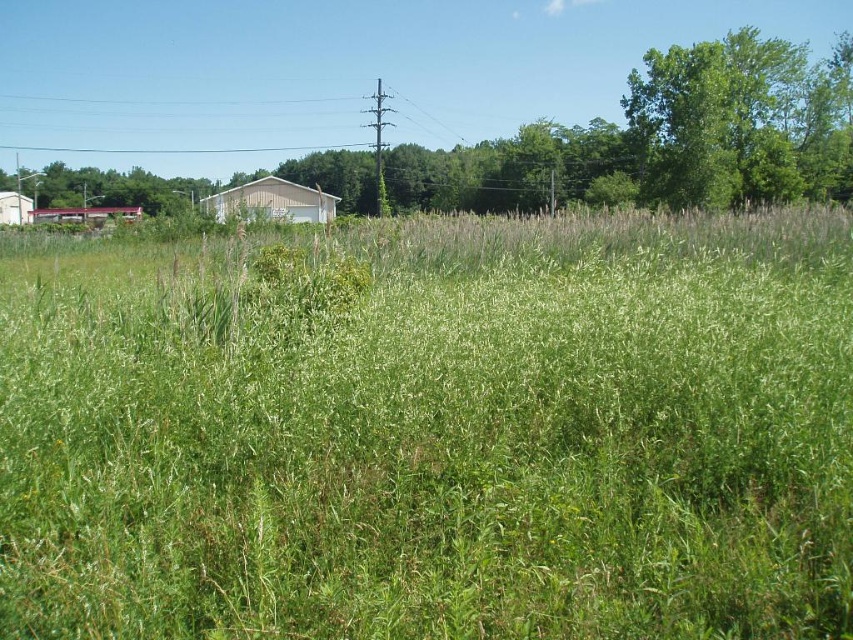
Question: Which point is closer to the camera?

Choices:
 (A) (248, 186)
 (B) (676, 205)

Answer: (B)

Question: Observing the image, what is the correct spatial positioning of green leafy tree at upper right in reference to white wood hut at left?

Choices:
 (A) right
 (B) left

Answer: (A)

Question: Among these points, which one is farthest from the camera?

Choices:
 (A) pyautogui.click(x=839, y=154)
 (B) pyautogui.click(x=132, y=192)
 (C) pyautogui.click(x=6, y=204)

Answer: (B)

Question: Is white matte barn at center thinner than metallic red hut at left?

Choices:
 (A) no
 (B) yes

Answer: (B)

Question: Does metallic red hut at left appear over white wood hut at left?

Choices:
 (A) no
 (B) yes

Answer: (A)

Question: Considering the real-world distances, which object is closest to the metallic red hut at left?

Choices:
 (A) white wood hut at left
 (B) green grassy field at left

Answer: (A)